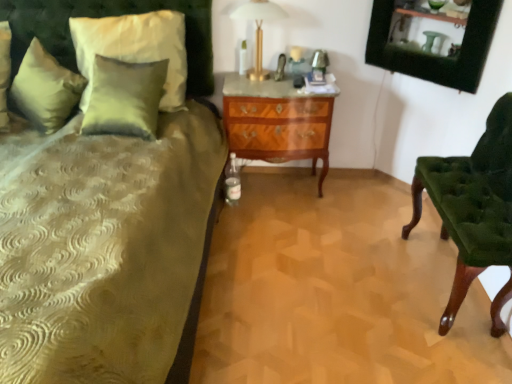
Question: From their relative heights in the image, would you say satin green pillow at upper left, placed as the second pillow when sorted from left to right, is taller or shorter than velvet green headboard at upper left?

Choices:
 (A) short
 (B) tall

Answer: (A)

Question: Relative to velvet green headboard at upper left, is satin green pillow at upper left, the 1th pillow when ordered from right to left, in front or behind?

Choices:
 (A) behind
 (B) front

Answer: (B)

Question: Which object is the closest to the gold metallic table lamp at upper center?

Choices:
 (A) satin green pillow at upper left, the 2th pillow viewed from the right
 (B) velvet green headboard at upper left
 (C) velvet green chair at right
 (D) mahogany wood drawer at center
 (E) satin green pillow at upper left, placed as the second pillow when sorted from left to right

Answer: (D)

Question: Considering the real-world distances, which object is farthest from the mahogany wood drawer at center?

Choices:
 (A) satin green pillow at upper left, placed as the second pillow when sorted from left to right
 (B) gold metallic table lamp at upper center
 (C) velvet green headboard at upper left
 (D) velvet green chair at right
 (E) satin green pillow at upper left, the 2th pillow viewed from the right

Answer: (E)